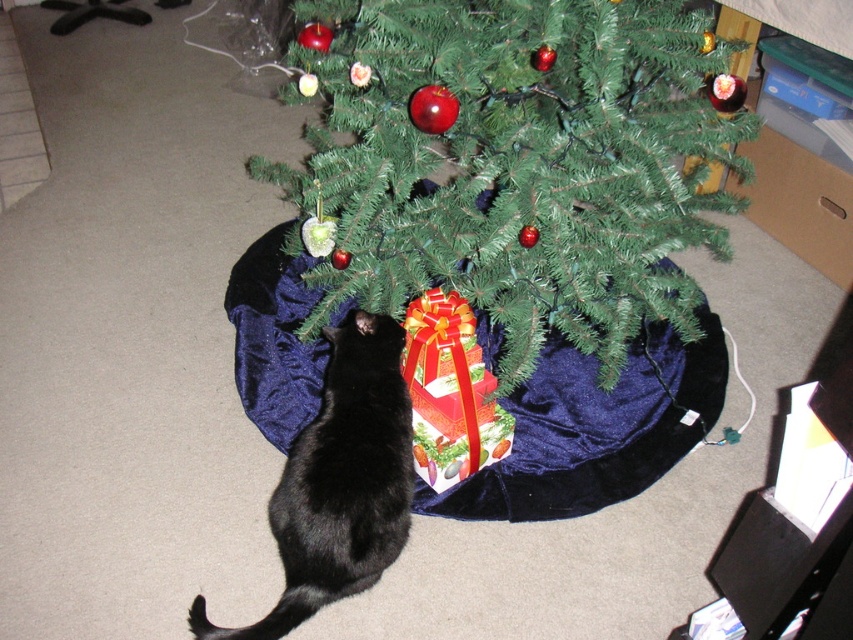
You are a curious cat sitting on the floor. You see the green matte christmas tree at center and the shiny paper gift at under tree. Which object is closer to your left side?

The shiny paper gift at under tree is closer to your left side because the green matte christmas tree at center is to the right of it.

Where is the green matte christmas tree at center located in the image?

The green matte christmas tree at center is located at point (517, 164).